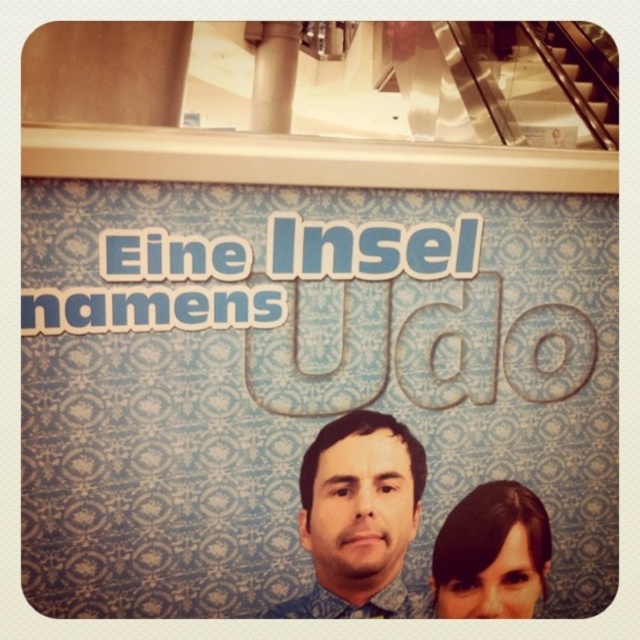
Who is lower down, blue patterned shirt at center or dark brown hair at upper center?

Positioned lower is dark brown hair at upper center.

Does blue patterned shirt at center have a greater width compared to dark brown hair at upper center?

Indeed, blue patterned shirt at center has a greater width compared to dark brown hair at upper center.

At what (x,y) coordinates should I click in order to perform the action: click on blue patterned shirt at center. Please return your answer as a coordinate pair (x, y). Image resolution: width=640 pixels, height=640 pixels. Looking at the image, I should click on (358, 516).

From the picture: Is blue patterned shirt at center above metallic silver escalator at upper right?

No, blue patterned shirt at center is not above metallic silver escalator at upper right.

Can you confirm if blue patterned shirt at center is shorter than metallic silver escalator at upper right?

No.

Which is in front, point (316, 467) or point (588, 81)?

Point (316, 467) is in front.

Locate an element on the screen. The width and height of the screenshot is (640, 640). blue patterned shirt at center is located at coordinates click(x=358, y=516).

Is dark brown hair at upper center taller than metallic silver escalator at upper right?

No.

Does dark brown hair at upper center appear on the right side of metallic silver escalator at upper right?

In fact, dark brown hair at upper center is to the left of metallic silver escalator at upper right.

Which is behind, point (493, 563) or point (602, 100)?

Point (602, 100)

I want to click on dark brown hair at upper center, so click(492, 554).